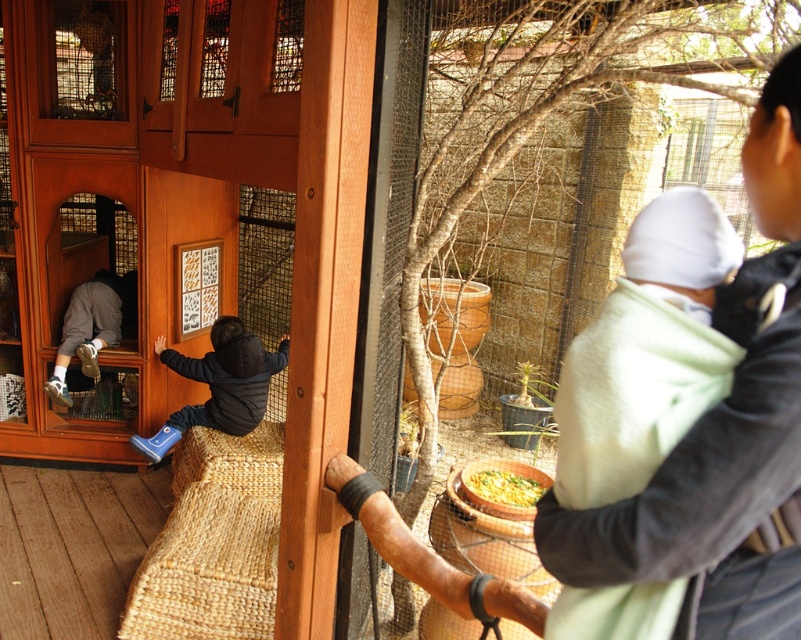
You are standing in front of the playhouse and want to locate two specific points. The first point is at coordinate (x=208, y=365) and the second point is at (x=502, y=480). Which of these points is closer to you?

Point (x=208, y=365) is closer to you because it is further to the viewer than point (x=502, y=480).

You are a parent trying to place a 30 inch long wooden toy box between the matte wood screen door at left and the blue rubber boots at left. Can the toy box fit in the space between them?

The matte wood screen door at left is 30.18 inches away from the blue rubber boots at left, so the 30 inch long wooden toy box can fit in the space between them since the distance is slightly more than the toy box length.

You are a parent trying to reach the blue rubber boots at left for your child. The matte wood screen door at left is blocking your path. Can you step around the door to get to the boots?

The matte wood screen door at left is taller than blue rubber boots at left, so you can step around the door to reach the blue rubber boots at left since the boots are shorter and easier to access.